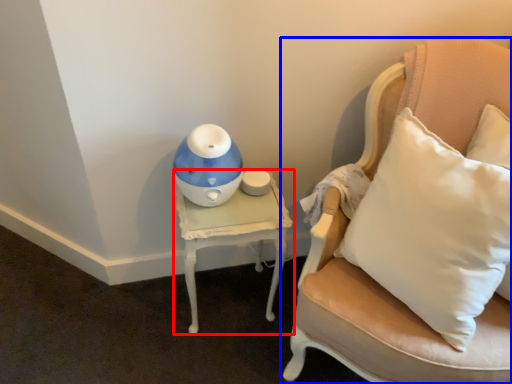
Question: Which object is further to the camera taking this photo, table (highlighted by a red box) or chair (highlighted by a blue box)?

Choices:
 (A) table
 (B) chair

Answer: (A)